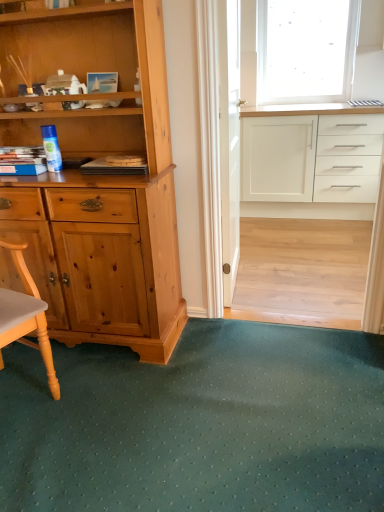
Find the location of a particular element. This screenshot has height=512, width=384. transparent frosted glass at upper right is located at coordinates (306, 50).

The height and width of the screenshot is (512, 384). What do you see at coordinates (229, 139) in the screenshot?
I see `clear glass screen door at center` at bounding box center [229, 139].

Where is `white glossy cabinet at upper right`? The height and width of the screenshot is (512, 384). white glossy cabinet at upper right is located at coordinates (304, 157).

You are a GUI agent. You are given a task and a screenshot of the screen. Output one action in this format:
    pyautogui.click(x=<x>, y=<y>)
    Task: Click on the transparent frosted glass at upper right
    
    Given the screenshot: What is the action you would take?
    pyautogui.click(x=306, y=50)

The image size is (384, 512). In order to click on cabinetry below the clear glass screen door at center (from a real-world perspective) in this screenshot , I will do `click(304, 157)`.

Which point is more forward, (233, 61) or (344, 186)?

Point (233, 61)

Visually, is clear glass screen door at center positioned to the left or to the right of white glossy cabinet at upper right?

Clearly, clear glass screen door at center is on the left of white glossy cabinet at upper right in the image.

How far apart are clear glass screen door at center and white glossy cabinet at upper right?

They are 1.40 meters apart.

Where is `window located behind the white glossy cabinet at upper right`? window located behind the white glossy cabinet at upper right is located at coordinates 306,50.

From the image's perspective, who appears lower, white glossy cabinet at upper right or transparent frosted glass at upper right?

white glossy cabinet at upper right appears lower in the image.

Which of these two, white glossy cabinet at upper right or transparent frosted glass at upper right, stands shorter?

Standing shorter between the two is white glossy cabinet at upper right.

Between white glossy cabinet at upper right and green textured mat at lower center, which one has more height?

Standing taller between the two is white glossy cabinet at upper right.

Is white glossy cabinet at upper right to the left or to the right of green textured mat at lower center in the image?

From the image, it's evident that white glossy cabinet at upper right is to the right of green textured mat at lower center.

How much distance is there between white glossy cabinet at upper right and green textured mat at lower center?

white glossy cabinet at upper right is 2.31 meters away from green textured mat at lower center.

How different are the orientations of white glossy cabinet at upper right and green textured mat at lower center in degrees?

The angle between the facing direction of white glossy cabinet at upper right and the facing direction of green textured mat at lower center is 88.9 degrees.

Considering the sizes of objects clear glass screen door at center and green textured mat at lower center in the image provided, who is shorter, clear glass screen door at center or green textured mat at lower center?

green textured mat at lower center.

Which is more distant, (226, 202) or (235, 333)?

The point (226, 202) is farther from the camera.

Is clear glass screen door at center placed right next to green textured mat at lower center?

No, clear glass screen door at center is not beside green textured mat at lower center.

From the picture: From the image's perspective, relative to green textured mat at lower center, is clear glass screen door at center above or below?

clear glass screen door at center is above green textured mat at lower center.

Which is correct: white glossy cabinet at upper right is inside clear glass screen door at center, or outside of it?

white glossy cabinet at upper right is located beyond the bounds of clear glass screen door at center.

Which of these two, white glossy cabinet at upper right or clear glass screen door at center, is thinner?

With smaller width is clear glass screen door at center.

From the image's perspective, is white glossy cabinet at upper right over clear glass screen door at center?

Correct, white glossy cabinet at upper right appears higher than clear glass screen door at center in the image.

Are white glossy cabinet at upper right and clear glass screen door at center far apart?

Absolutely, white glossy cabinet at upper right is distant from clear glass screen door at center.

Image resolution: width=384 pixels, height=512 pixels. Find the location of `window lying behind the green textured mat at lower center`. window lying behind the green textured mat at lower center is located at coordinates (306, 50).

Between point (148, 453) and point (306, 76), which one is positioned in front?

Positioned in front is point (148, 453).

Which object is wider, green textured mat at lower center or transparent frosted glass at upper right?

green textured mat at lower center.

Between green textured mat at lower center and transparent frosted glass at upper right, which one appears on the left side from the viewer's perspective?

Positioned to the left is green textured mat at lower center.

Does point (86, 472) come closer to viewer compared to point (237, 19)?

Yes, point (86, 472) is in front of point (237, 19).

Is green textured mat at lower center oriented towards clear glass screen door at center?

No, green textured mat at lower center is not oriented towards clear glass screen door at center.

Considering the sizes of objects green textured mat at lower center and clear glass screen door at center in the image provided, who is wider, green textured mat at lower center or clear glass screen door at center?

With larger width is green textured mat at lower center.

Can you confirm if green textured mat at lower center is taller than clear glass screen door at center?

No.

This screenshot has width=384, height=512. What are the coordinates of `cabinetry behind the clear glass screen door at center` in the screenshot? It's located at (304, 157).

At what (x,y) coordinates should I click in order to perform the action: click on window above the white glossy cabinet at upper right (from a real-world perspective). Please return your answer as a coordinate pair (x, y). The width and height of the screenshot is (384, 512). Looking at the image, I should click on (306, 50).

Based on their spatial positions, is clear glass screen door at center or transparent frosted glass at upper right further from white glossy cabinet at upper right?

clear glass screen door at center.

Considering their positions, is green textured mat at lower center positioned further to clear glass screen door at center than transparent frosted glass at upper right?

The object further to clear glass screen door at center is transparent frosted glass at upper right.

Which object lies further to the anchor point white glossy cabinet at upper right, green textured mat at lower center or clear glass screen door at center?

Based on the image, green textured mat at lower center appears to be further to white glossy cabinet at upper right.

Which object lies nearer to the anchor point green textured mat at lower center, clear glass screen door at center or white glossy cabinet at upper right?

clear glass screen door at center.

Consider the image. From the image, which object appears to be nearer to transparent frosted glass at upper right, white glossy cabinet at upper right or clear glass screen door at center?

Based on the image, white glossy cabinet at upper right appears to be nearer to transparent frosted glass at upper right.

Looking at the image, which one is located closer to green textured mat at lower center, transparent frosted glass at upper right or white glossy cabinet at upper right?

Among the two, white glossy cabinet at upper right is located nearer to green textured mat at lower center.

Looking at the image, which one is located further to transparent frosted glass at upper right, green textured mat at lower center or clear glass screen door at center?

green textured mat at lower center is further to transparent frosted glass at upper right.

From the image, which object appears to be farther from transparent frosted glass at upper right, green textured mat at lower center or white glossy cabinet at upper right?

green textured mat at lower center.

Identify the location of screen door between green textured mat at lower center and white glossy cabinet at upper right in the front-back direction. (229, 139).

The height and width of the screenshot is (512, 384). I want to click on cabinetry between clear glass screen door at center and transparent frosted glass at upper right in the front-back direction, so click(304, 157).

You are a GUI agent. You are given a task and a screenshot of the screen. Output one action in this format:
    pyautogui.click(x=<x>, y=<y>)
    Task: Click on the screen door positioned between green textured mat at lower center and transparent frosted glass at upper right from near to far
    
    Given the screenshot: What is the action you would take?
    pyautogui.click(x=229, y=139)

Where is `cabinetry between green textured mat at lower center and transparent frosted glass at upper right from front to back`? The width and height of the screenshot is (384, 512). cabinetry between green textured mat at lower center and transparent frosted glass at upper right from front to back is located at coordinates (304, 157).